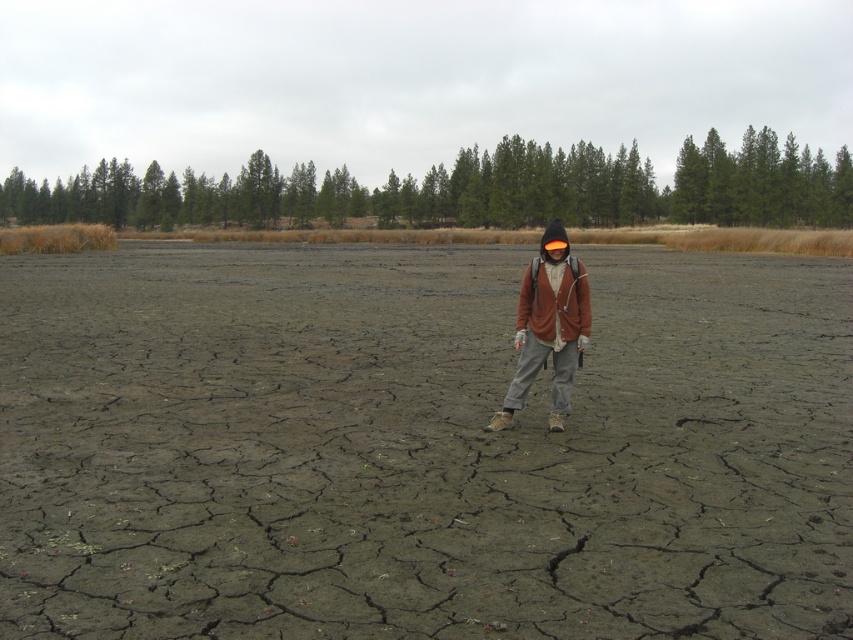
Question: Observing the image, what is the correct spatial positioning of dull gray mud at center in reference to brown soft jacket at center?

Choices:
 (A) right
 (B) left

Answer: (A)

Question: Does brown woolen sweater at center appear on the right side of brown soft jacket at center?

Choices:
 (A) yes
 (B) no

Answer: (A)

Question: Which is farther from the brown woolen sweater at center?

Choices:
 (A) dull gray mud at center
 (B) brown soft jacket at center

Answer: (A)

Question: Is dull gray mud at center below brown soft jacket at center?

Choices:
 (A) no
 (B) yes

Answer: (A)

Question: Which of the following is the farthest from the observer?

Choices:
 (A) (535, 307)
 (B) (682, 444)

Answer: (A)

Question: Which object is the farthest from the brown woolen sweater at center?

Choices:
 (A) brown soft jacket at center
 (B) dull gray mud at center

Answer: (B)